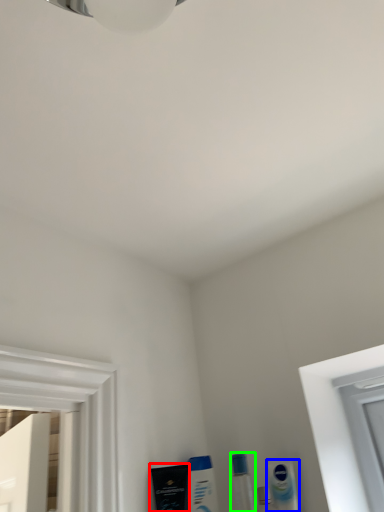
Question: Based on their relative distances, which object is nearer to mouthwash (highlighted by a red box)? Choose from mouthwash (highlighted by a blue box) and toiletry (highlighted by a green box).

Choices:
 (A) mouthwash
 (B) toiletry

Answer: (B)